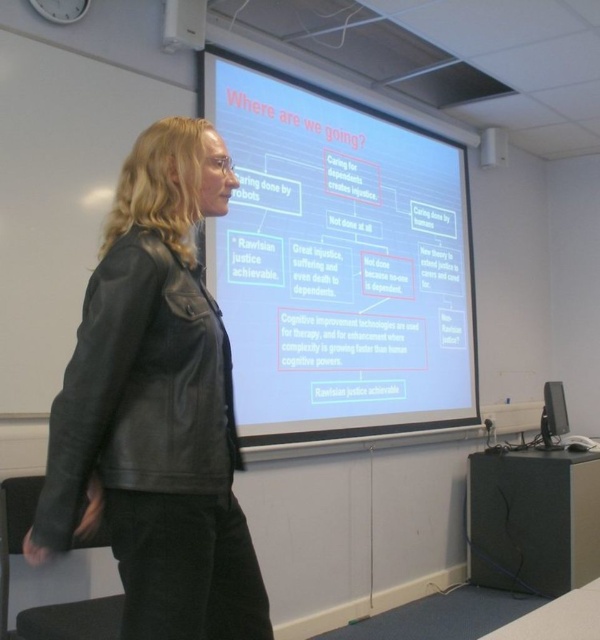
Question: Which object is farther from the camera taking this photo?

Choices:
 (A) white matte projection screen at upper center
 (B) black leather jacket at left
 (C) whiteboard at upper left

Answer: (A)

Question: Is black leather jacket at left thinner than whiteboard at upper left?

Choices:
 (A) yes
 (B) no

Answer: (A)

Question: Does white matte projection screen at upper center lie behind whiteboard at upper left?

Choices:
 (A) no
 (B) yes

Answer: (B)

Question: Which point is farther to the camera?

Choices:
 (A) (16, 33)
 (B) (337, 397)
 (C) (30, 561)

Answer: (B)

Question: Does white matte projection screen at upper center have a larger size compared to black leather jacket at left?

Choices:
 (A) yes
 (B) no

Answer: (A)

Question: Among these points, which one is farthest from the camera?

Choices:
 (A) (61, 228)
 (B) (178, 600)
 (C) (295, 348)

Answer: (C)